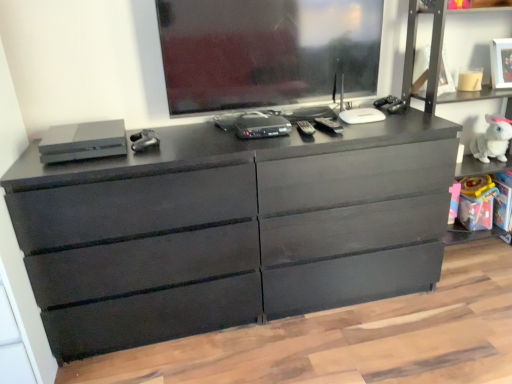
The height and width of the screenshot is (384, 512). What do you see at coordinates (329, 125) in the screenshot?
I see `black plastic remote control at center, which ranks as the third equipment in left-to-right order` at bounding box center [329, 125].

Locate an element on the screen. matte black dresser at center is located at coordinates (230, 229).

At what (x,y) coordinates should I click in order to perform the action: click on white matte picture frame at upper right. Please return your answer as a coordinate pair (x, y). Looking at the image, I should click on (501, 63).

Where is `translucent plastic toy at right`? translucent plastic toy at right is located at coordinates (476, 202).

What do you see at coordinates (492, 140) in the screenshot? I see `white plush rabbit at right` at bounding box center [492, 140].

This screenshot has height=384, width=512. Describe the element at coordinates (144, 140) in the screenshot. I see `matte black controller at center, marked as the 2th equipment in a left-to-right arrangement` at that location.

What is the approximate width of matte black controller at center, marked as the 2th equipment in a left-to-right arrangement?

matte black controller at center, marked as the 2th equipment in a left-to-right arrangement, is 6.65 inches wide.

At what (x,y) coordinates should I click in order to perform the action: click on black plastic remote control at center, which ranks as the third equipment in left-to-right order. Please return your answer as a coordinate pair (x, y). Looking at the image, I should click on (329, 125).

Is matte black dresser at right looking in the opposite direction of matte black dresser at center?

matte black dresser at right does not have its back to matte black dresser at center.

What are the coordinates of `tv cabinet that is behind the matte black dresser at center` in the screenshot? It's located at (435, 53).

Is matte black dresser at right bigger than matte black dresser at center?

Actually, matte black dresser at right might be smaller than matte black dresser at center.

Visually, is matte black dresser at right positioned to the left or to the right of matte black dresser at center?

Clearly, matte black dresser at right is on the right of matte black dresser at center in the image.

Can you tell me how much white matte picture frame at upper right and white plush rabbit at right differ in facing direction?

12.5 degrees separate the facing orientations of white matte picture frame at upper right and white plush rabbit at right.

You are a GUI agent. You are given a task and a screenshot of the screen. Output one action in this format:
    pyautogui.click(x=<x>, y=<y>)
    Task: Click on the animal beneath the white matte picture frame at upper right (from a real-world perspective)
    Image resolution: width=512 pixels, height=384 pixels.
    Given the screenshot: What is the action you would take?
    pyautogui.click(x=492, y=140)

Is white matte picture frame at upper right positioned in front of white plush rabbit at right?

Yes, white matte picture frame at upper right is closer to the viewer.

Could you tell me if matte black dresser at right is turned towards matte black controller at center, positioned as the 2th equipment in right-to-left order?

No, matte black dresser at right is not turned towards matte black controller at center, positioned as the 2th equipment in right-to-left order.

In terms of width, does matte black dresser at right look wider or thinner when compared to matte black controller at center, positioned as the 2th equipment in right-to-left order?

Clearly, matte black dresser at right has more width compared to matte black controller at center, positioned as the 2th equipment in right-to-left order.

Looking at the image, does matte black dresser at right seem bigger or smaller compared to matte black controller at center, marked as the 2th equipment in a left-to-right arrangement?

Clearly, matte black dresser at right is larger in size than matte black controller at center, marked as the 2th equipment in a left-to-right arrangement.

Can you confirm if matte black dresser at right is shorter than matte black controller at center, marked as the 2th equipment in a left-to-right arrangement?

No, matte black dresser at right is not shorter than matte black controller at center, marked as the 2th equipment in a left-to-right arrangement.

Is white matte picture frame at upper right facing towards translucent plastic toy at right?

No, white matte picture frame at upper right is not facing towards translucent plastic toy at right.

Considering the sizes of white matte picture frame at upper right and translucent plastic toy at right in the image, is white matte picture frame at upper right wider or thinner than translucent plastic toy at right?

In the image, white matte picture frame at upper right appears to be more narrow than translucent plastic toy at right.

How different are the orientations of white matte picture frame at upper right and translucent plastic toy at right in degrees?

The facing directions of white matte picture frame at upper right and translucent plastic toy at right are 12.5 degrees apart.

Which is behind, white matte picture frame at upper right or translucent plastic toy at right?

Positioned behind is translucent plastic toy at right.

Can you confirm if matte black dresser at center is shorter than black plastic remote control at center, which ranks as the third equipment in left-to-right order?

In fact, matte black dresser at center may be taller than black plastic remote control at center, which ranks as the third equipment in left-to-right order.

Does matte black dresser at center touch black plastic remote control at center, the 1th equipment when ordered from right to left?

No, matte black dresser at center is not touching black plastic remote control at center, the 1th equipment when ordered from right to left.

Which is in front, matte black dresser at center or black plastic remote control at center, which ranks as the third equipment in left-to-right order?

matte black dresser at center is more forward.

In terms of width, does white plush rabbit at right look wider or thinner when compared to white matte picture frame at upper right?

Considering their sizes, white plush rabbit at right looks broader than white matte picture frame at upper right.

Considering the positions of objects white plush rabbit at right and white matte picture frame at upper right in the image provided, who is more to the left, white plush rabbit at right or white matte picture frame at upper right?

white plush rabbit at right.

From the image's perspective, is translucent plastic toy at right located above or below black plastic remote control at center, the 1th equipment when ordered from right to left?

translucent plastic toy at right is situated lower than black plastic remote control at center, the 1th equipment when ordered from right to left, in the image.

From the picture: Is translucent plastic toy at right shorter than black plastic remote control at center, which ranks as the third equipment in left-to-right order?

No, translucent plastic toy at right is not shorter than black plastic remote control at center, which ranks as the third equipment in left-to-right order.

Consider the image. Can you see translucent plastic toy at right touching black plastic remote control at center, which ranks as the third equipment in left-to-right order?

No, translucent plastic toy at right is not next to black plastic remote control at center, which ranks as the third equipment in left-to-right order.

Does translucent plastic toy at right have a smaller size compared to black plastic remote control at center, which ranks as the third equipment in left-to-right order?

Incorrect, translucent plastic toy at right is not smaller in size than black plastic remote control at center, which ranks as the third equipment in left-to-right order.

Identify the location of the chest of drawers below the matte black dresser at right (from the image's perspective). The image size is (512, 384). (230, 229).

Identify the location of picture frame to the right of white plush rabbit at right. (501, 63).

From the image, which object appears to be farther from matte black dresser at center, white plush rabbit at right or matte black controller at center, marked as the 2th equipment in a left-to-right arrangement?

Among the two, white plush rabbit at right is located further to matte black dresser at center.

When comparing their distances from translucent plastic toy at right, does white matte picture frame at upper right or matte black dresser at center seem further?

matte black dresser at center is positioned further to the anchor translucent plastic toy at right.

Considering their positions, is translucent plastic toy at right positioned closer to matte black dresser at right than black plastic remote control at center, the 1th equipment when ordered from right to left?

Among the two, black plastic remote control at center, the 1th equipment when ordered from right to left, is located nearer to matte black dresser at right.

Estimate the real-world distances between objects in this image. Which object is further from translucent plastic toy at right, satin gray console at left, the first equipment viewed from the left, or black plastic remote control at center, which ranks as the third equipment in left-to-right order?

satin gray console at left, the first equipment viewed from the left.

From the image, which object appears to be farther from satin gray console at left, the first equipment viewed from the left, black plastic remote control at center, which ranks as the third equipment in left-to-right order, or white matte picture frame at upper right?

white matte picture frame at upper right lies further to satin gray console at left, the first equipment viewed from the left, than the other object.

Based on their spatial positions, is translucent plastic toy at right or satin gray console at left, marked as the 3th equipment in a right-to-left arrangement, further from black plastic remote control at center, which ranks as the third equipment in left-to-right order?

Based on the image, translucent plastic toy at right appears to be further to black plastic remote control at center, which ranks as the third equipment in left-to-right order.

Which object lies nearer to the anchor point matte black dresser at center, satin gray console at left, the first equipment viewed from the left, or matte black controller at center, positioned as the 2th equipment in right-to-left order?

Based on the image, satin gray console at left, the first equipment viewed from the left, appears to be nearer to matte black dresser at center.

Which object lies further to the anchor point matte black dresser at center, white matte picture frame at upper right or white plush rabbit at right?

Among the two, white matte picture frame at upper right is located further to matte black dresser at center.

You are a GUI agent. You are given a task and a screenshot of the screen. Output one action in this format:
    pyautogui.click(x=<x>, y=<y>)
    Task: Click on the equipment located between matte black controller at center, positioned as the 2th equipment in right-to-left order, and translucent plastic toy at right in the left-right direction
    
    Given the screenshot: What is the action you would take?
    pos(329,125)

Locate an element on the screen. Image resolution: width=512 pixels, height=384 pixels. chest of drawers between matte black controller at center, positioned as the 2th equipment in right-to-left order, and matte black dresser at right, in the horizontal direction is located at coordinates (230, 229).

Find the location of a particular element. The height and width of the screenshot is (384, 512). animal between matte black controller at center, marked as the 2th equipment in a left-to-right arrangement, and white matte picture frame at upper right is located at coordinates (492, 140).

Locate an element on the screen. toy between matte black dresser at center and white plush rabbit at right from left to right is located at coordinates (476, 202).